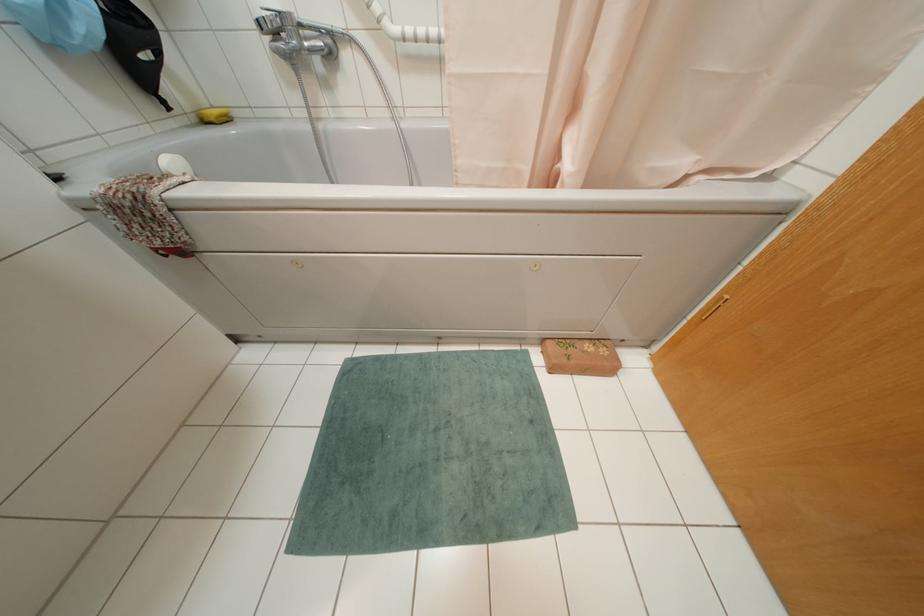
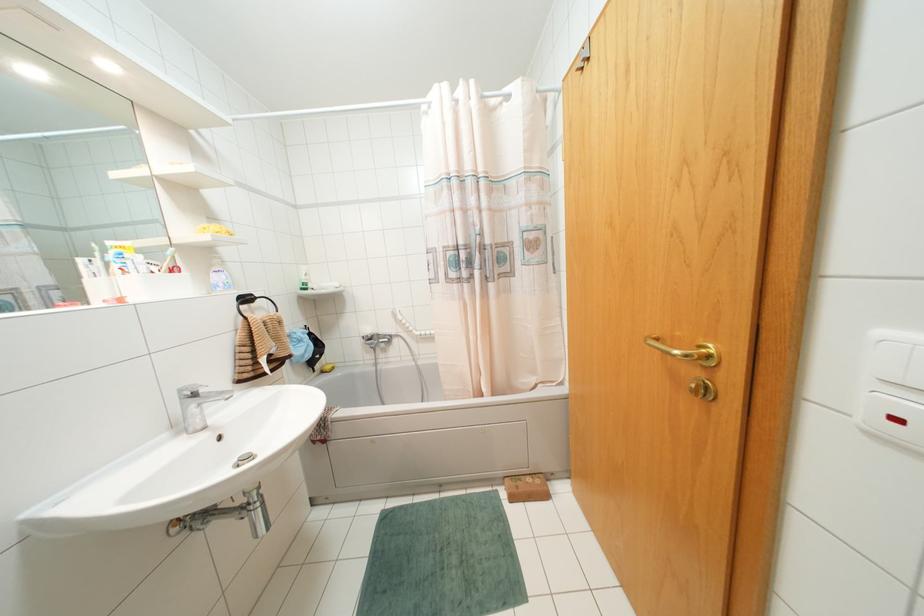
Question: The first image is from the beginning of the video and the second image is from the end. How did the camera likely rotate when shooting the video?

Choices:
 (A) Left
 (B) Right
 (C) Up
 (D) Down

Answer: (C)